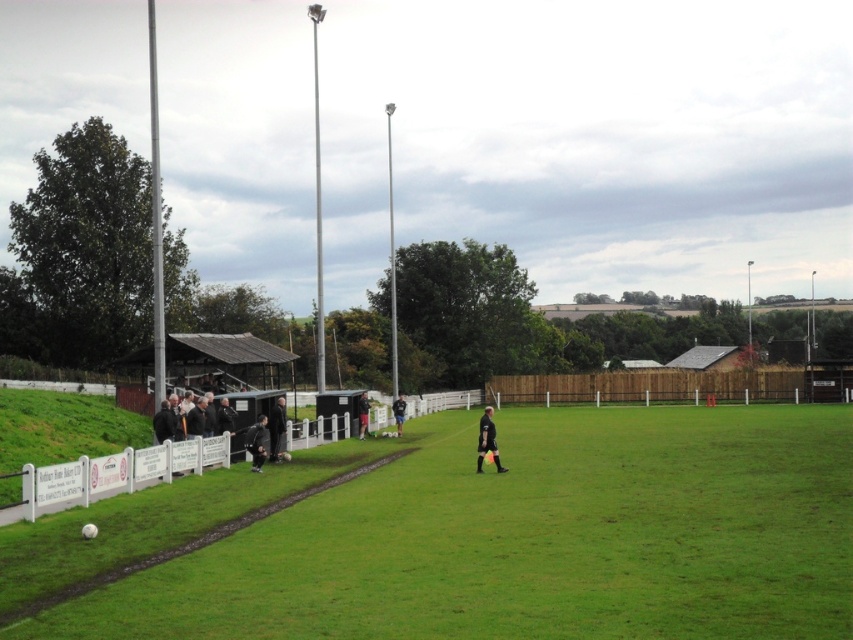
Based on the photo, is black matte soccer ball at center bigger than dark gray uniform at center?

Correct, black matte soccer ball at center is larger in size than dark gray uniform at center.

Does black matte soccer ball at center come in front of dark gray uniform at center?

Yes, black matte soccer ball at center is in front of dark gray uniform at center.

Measure the distance between point (486, 444) and camera.

Point (486, 444) and camera are 78.70 feet apart.

You are a GUI agent. You are given a task and a screenshot of the screen. Output one action in this format:
    pyautogui.click(x=<x>, y=<y>)
    Task: Click on the black matte soccer ball at center
    
    Given the screenshot: What is the action you would take?
    pyautogui.click(x=486, y=440)

Does green grass field at center appear under black matte jacket at center?

Incorrect, green grass field at center is not positioned below black matte jacket at center.

Is green grass field at center shorter than black matte jacket at center?

No.

The width and height of the screenshot is (853, 640). In order to click on green grass field at center in this screenshot , I will do `click(534, 540)`.

Can you confirm if green grass field at center is smaller than dark gray uniform at center?

Actually, green grass field at center might be larger than dark gray uniform at center.

Does green grass field at center come in front of dark gray uniform at center?

Yes, it is in front of dark gray uniform at center.

What do you see at coordinates (534, 540) in the screenshot? I see `green grass field at center` at bounding box center [534, 540].

At what (x,y) coordinates should I click in order to perform the action: click on green grass field at center. Please return your answer as a coordinate pair (x, y). This screenshot has width=853, height=640. Looking at the image, I should click on coord(534,540).